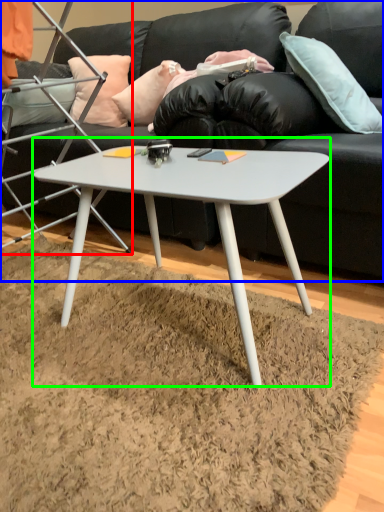
Question: Which is nearer to the chair (highlighted by a red box)? studio couch (highlighted by a blue box) or coffee table (highlighted by a green box).

Choices:
 (A) studio couch
 (B) coffee table

Answer: (A)